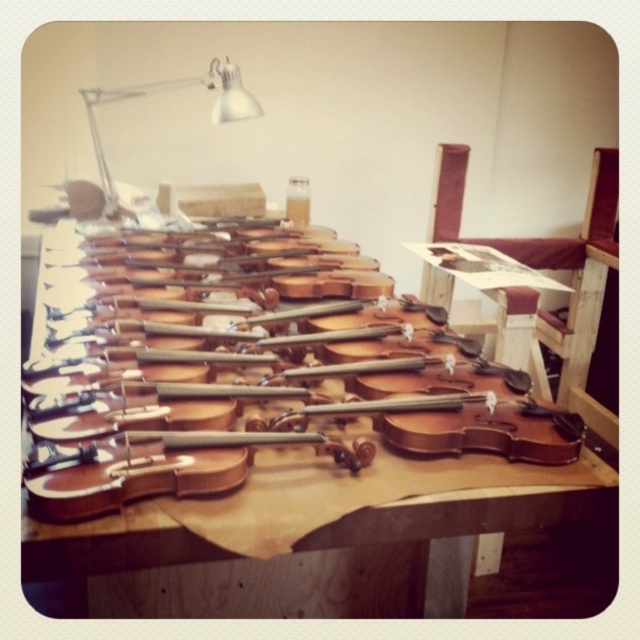
Question: Among these objects, which one is nearest to the camera?

Choices:
 (A) metallic silver lamp at upper left
 (B) natural wood violin at center

Answer: (B)

Question: Does natural wood violin at center lie in front of metallic silver lamp at upper left?

Choices:
 (A) yes
 (B) no

Answer: (A)

Question: Does natural wood violin at center have a smaller size compared to metallic silver lamp at upper left?

Choices:
 (A) yes
 (B) no

Answer: (B)

Question: Which object is closer to the camera taking this photo?

Choices:
 (A) metallic silver lamp at upper left
 (B) natural wood violin at center

Answer: (B)

Question: Considering the relative positions of natural wood violin at center and metallic silver lamp at upper left in the image provided, where is natural wood violin at center located with respect to metallic silver lamp at upper left?

Choices:
 (A) right
 (B) left

Answer: (A)